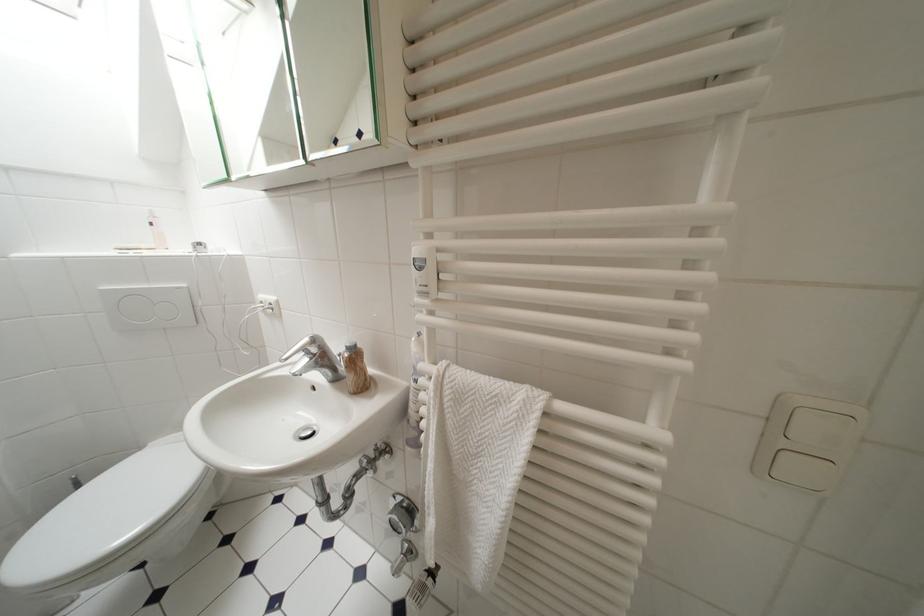
Where is `silver faucet handle`? Image resolution: width=924 pixels, height=616 pixels. silver faucet handle is located at coordinates (301, 346).